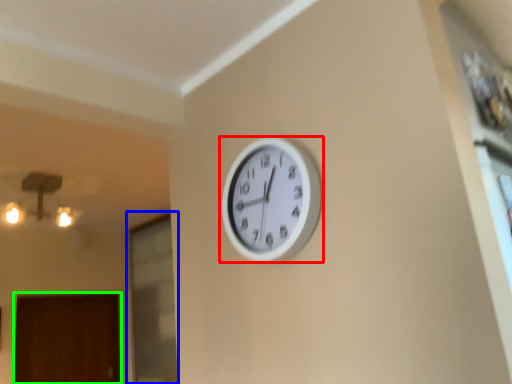
Question: Estimate the real-world distances between objects in this image. Which object is farther from wall clock (highlighted by a red box), glass door (highlighted by a blue box) or door (highlighted by a green box)?

Choices:
 (A) glass door
 (B) door

Answer: (B)